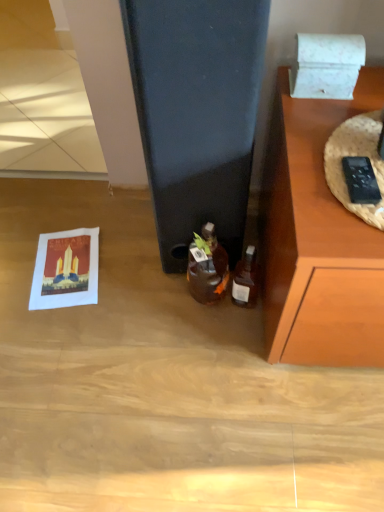
The height and width of the screenshot is (512, 384). I want to click on free space in front of translucent glass bottle at lower right, which ranks as the 1th bottle in right-to-left order, so click(238, 352).